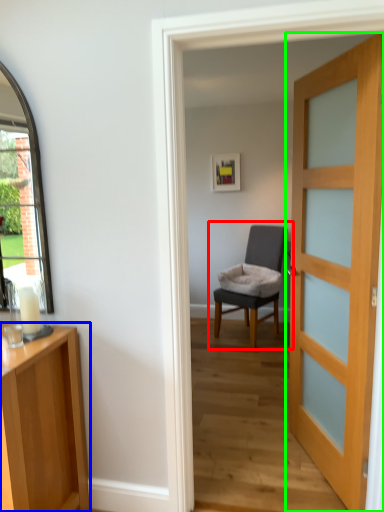
Question: Which is farther away from chair (highlighted by a red box)? cabinetry (highlighted by a blue box) or door (highlighted by a green box)?

Choices:
 (A) cabinetry
 (B) door

Answer: (A)